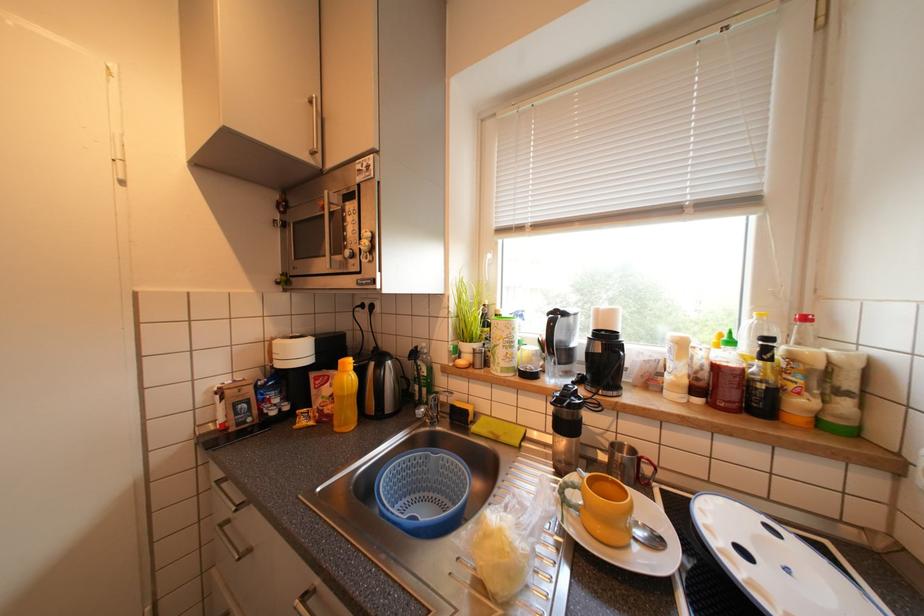
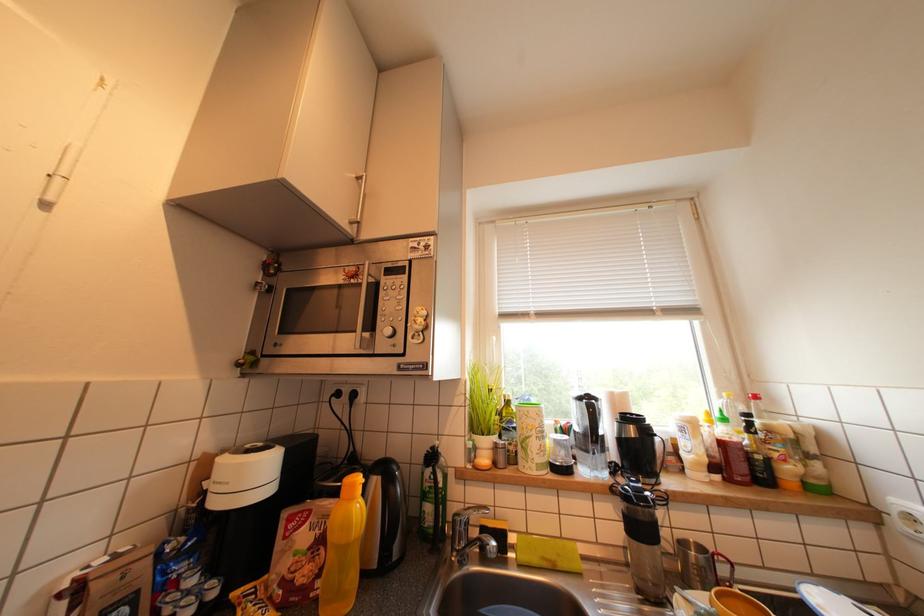
The images are taken continuously from a first-person perspective. In which direction is your viewpoint rotating?

The camera's rotation is toward right-up.